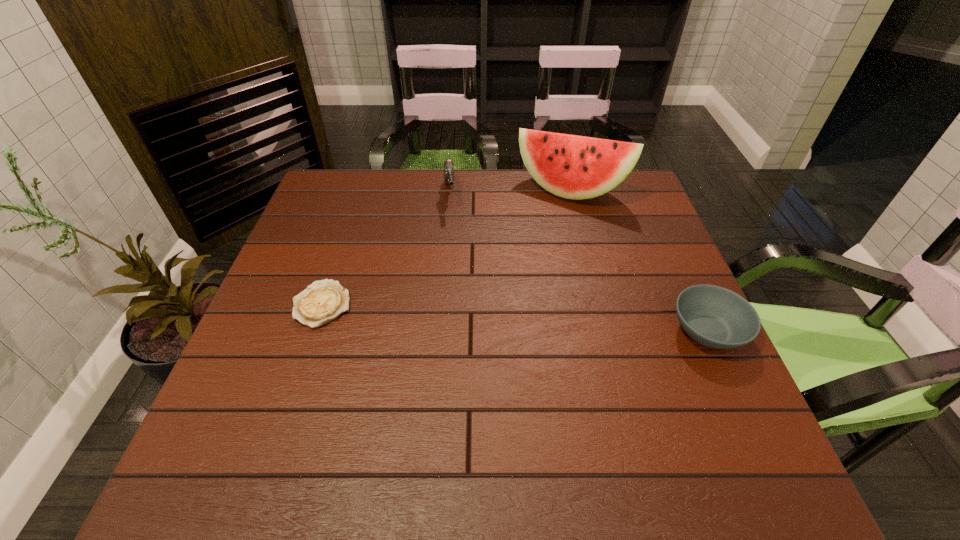
Find the location of a particular element. quiche is located at coordinates (323, 301).

Locate an element on the screen. The image size is (960, 540). the leftmost object is located at coordinates (323, 301).

The image size is (960, 540). In order to click on soup bowl in this screenshot , I will do `click(713, 316)`.

I want to click on the second object from left to right, so click(x=449, y=170).

Find the location of a particular element. Image resolution: width=960 pixels, height=540 pixels. the second tallest object is located at coordinates (449, 170).

Locate an element on the screen. This screenshot has width=960, height=540. watermelon is located at coordinates (575, 167).

I want to click on vacant position located on the right of the shortest object, so click(517, 304).

The image size is (960, 540). Find the location of `free spot located on the back of the second shortest object`. free spot located on the back of the second shortest object is located at coordinates (655, 215).

Identify the location of vacant position located at the barrel of the third object from right to left. (461, 317).

This screenshot has width=960, height=540. I want to click on free region located 0.180m at the barrel of the third object from right to left, so click(x=454, y=253).